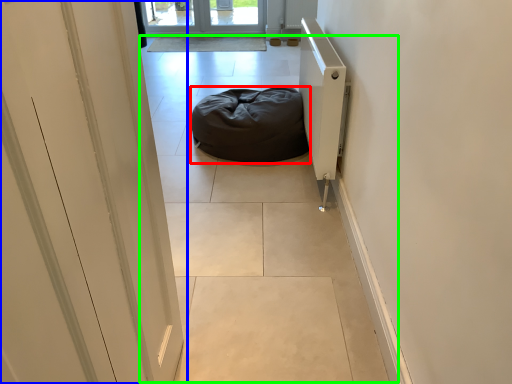
Question: Which is farther away from furniture (highlighted by a red box)? door (highlighted by a blue box) or path (highlighted by a green box)?

Choices:
 (A) door
 (B) path

Answer: (A)